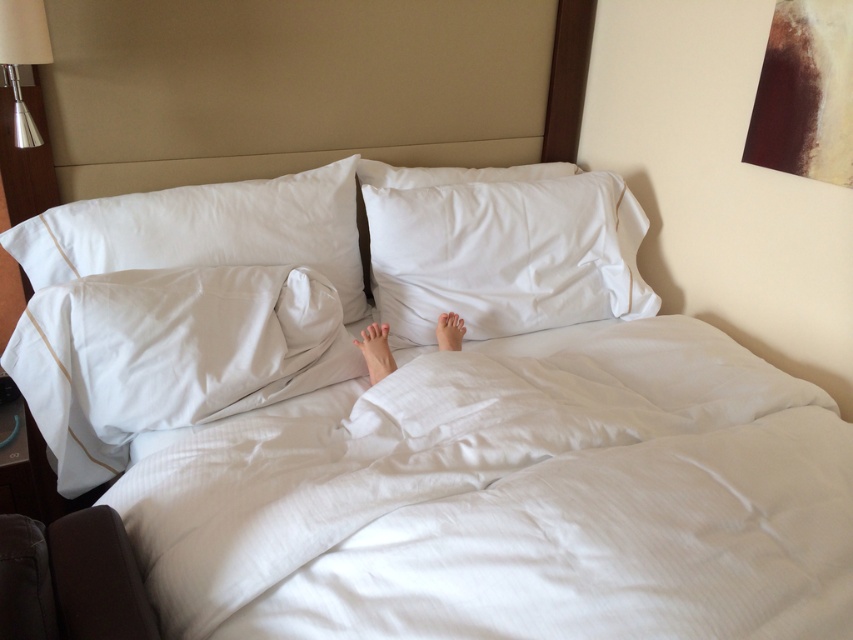
Between point (235, 257) and point (361, 337), which one is positioned in front?

Point (235, 257) is more forward.

Between point (100, 260) and point (366, 326), which one is positioned behind?

The point (366, 326) is more distant.

Who is more forward, (194, 202) or (395, 364)?

Point (395, 364)

Where is `white satin pillow at upper left`? The height and width of the screenshot is (640, 853). white satin pillow at upper left is located at coordinates (204, 230).

In the scene shown: Between skinny white feet at center and white smooth foot at center, which one appears on the left side from the viewer's perspective?

skinny white feet at center is more to the left.

Is point (378, 349) closer to viewer compared to point (457, 321)?

Yes.

Where is `skinny white feet at center`? This screenshot has width=853, height=640. skinny white feet at center is located at coordinates click(x=376, y=352).

Between white textured pillow at lower left and metallic silver lampshade at upper left, which one is positioned lower?

white textured pillow at lower left is lower down.

Describe the element at coordinates (160, 355) in the screenshot. I see `white textured pillow at lower left` at that location.

Between point (97, 323) and point (21, 132), which one is positioned in front?

Positioned in front is point (97, 323).

At what (x,y) coordinates should I click in order to perform the action: click on white textured pillow at lower left. Please return your answer as a coordinate pair (x, y). Looking at the image, I should click on (160, 355).